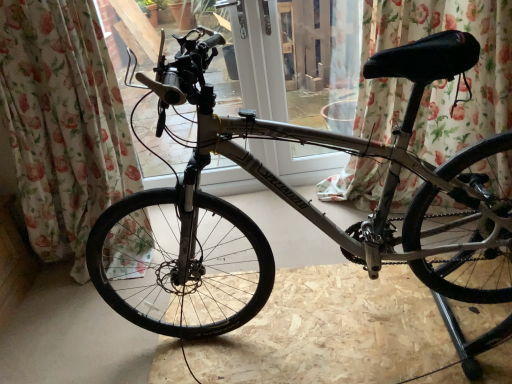
In order to click on vacant area situated below silver metallic bicycle at center (from a real-world perspective) in this screenshot , I will do `click(333, 327)`.